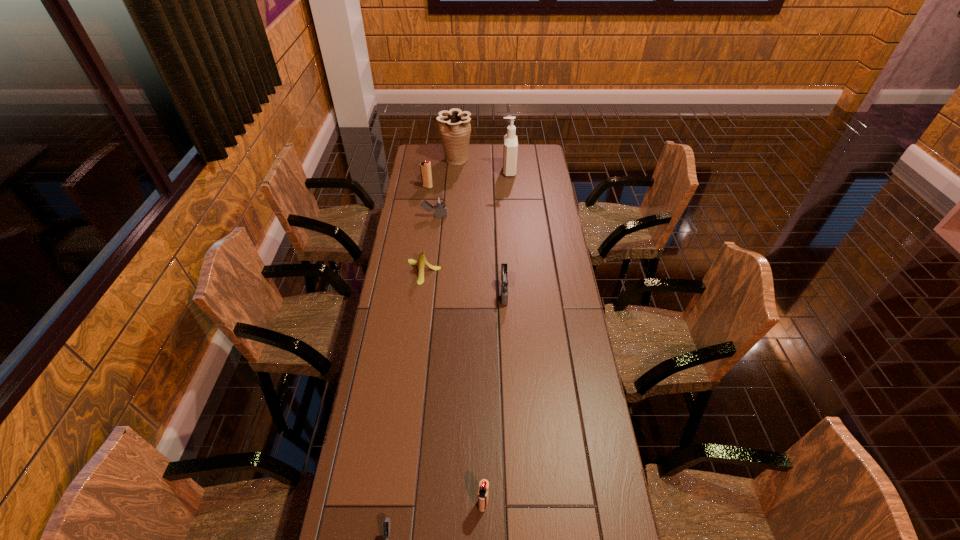
Identify the location of the tallest object. The image size is (960, 540). (510, 148).

Find the location of a particular element. This screenshot has height=540, width=960. the second tallest object is located at coordinates (454, 125).

Find the location of a particular element. The image size is (960, 540). the left red igniter is located at coordinates click(x=425, y=167).

Locate an element on the screen. the farther red igniter is located at coordinates (425, 167).

Where is `the rightmost igniter`? Image resolution: width=960 pixels, height=540 pixels. the rightmost igniter is located at coordinates (505, 279).

I want to click on the third farthest igniter, so click(505, 279).

This screenshot has height=540, width=960. I want to click on banana, so click(x=422, y=261).

You are a GUI agent. You are given a task and a screenshot of the screen. Output one action in this format:
    pyautogui.click(x=<x>, y=<y>)
    Task: Click on the second biggest gray igniter
    The height and width of the screenshot is (540, 960).
    Given the screenshot: What is the action you would take?
    pyautogui.click(x=439, y=206)

This screenshot has width=960, height=540. I want to click on the fourth farthest object, so click(x=439, y=206).

Identify the location of the third object from right to left. This screenshot has height=540, width=960. (483, 492).